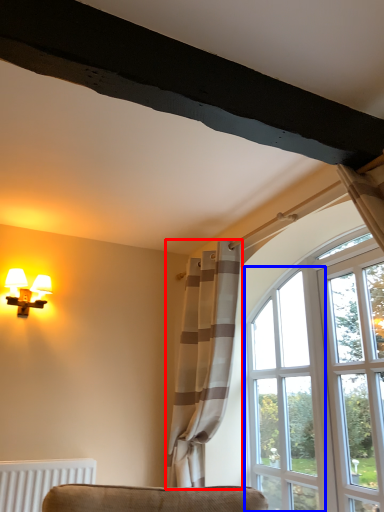
Question: Which object appears farthest to the camera in this image, curtain (highlighted by a red box) or window (highlighted by a blue box)?

Choices:
 (A) curtain
 (B) window

Answer: (B)